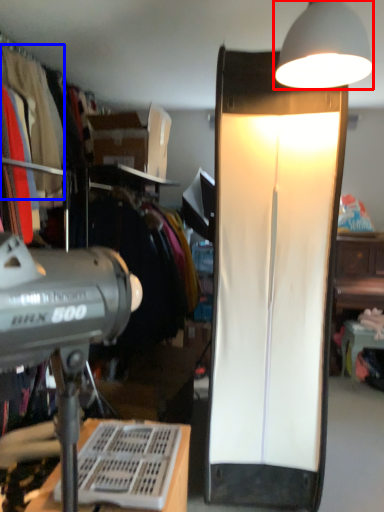
Question: Which point is closer to the camera, lamp (highlighted by a red box) or clothing (highlighted by a blue box)?

Choices:
 (A) lamp
 (B) clothing

Answer: (A)